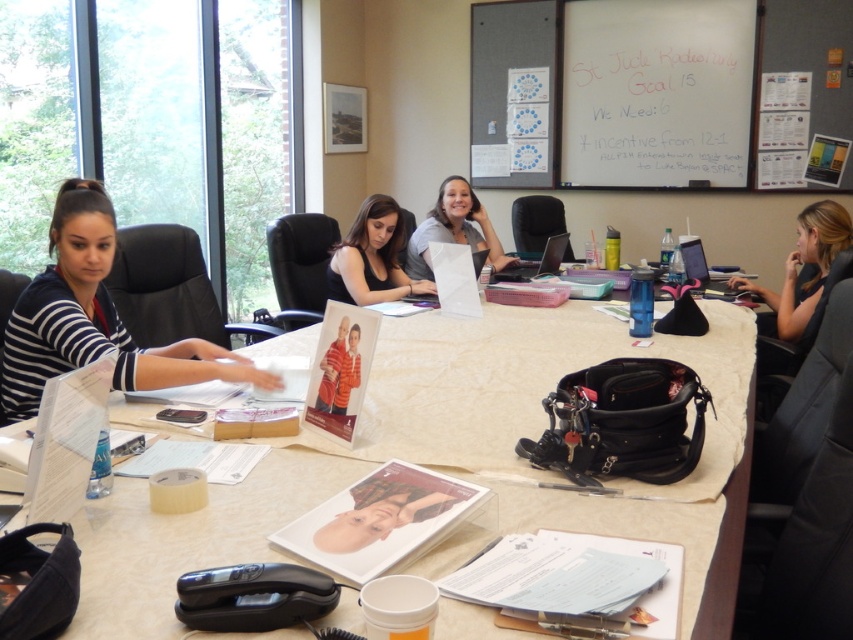
Question: Among these points, which one is farthest from the camera?

Choices:
 (A) (524, 260)
 (B) (381, 244)
 (C) (706, 280)

Answer: (A)

Question: Can you confirm if beige fabric table at center is bigger than whiteboard at upper center?

Choices:
 (A) no
 (B) yes

Answer: (B)

Question: Considering the relative positions of black leather purse at lower right and orange cotton shirt at center in the image provided, where is black leather purse at lower right located with respect to orange cotton shirt at center?

Choices:
 (A) below
 (B) above

Answer: (B)

Question: Which point is farther to the camera?

Choices:
 (A) (149, 589)
 (B) (850, 244)
 (C) (85, 237)

Answer: (B)

Question: Which point is farther to the camera?

Choices:
 (A) (407, 272)
 (B) (392, 529)
 (C) (614, 122)
 (D) (444, 636)

Answer: (C)

Question: Can you confirm if orange cotton shirt at center is thinner than pink fabric laptop at right?

Choices:
 (A) no
 (B) yes

Answer: (B)